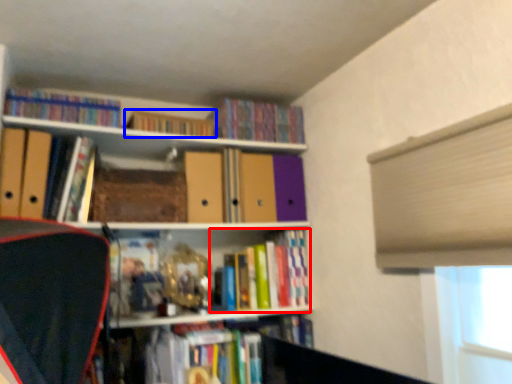
Question: Which object is closer to the camera taking this photo, book (highlighted by a red box) or book (highlighted by a blue box)?

Choices:
 (A) book
 (B) book

Answer: (B)